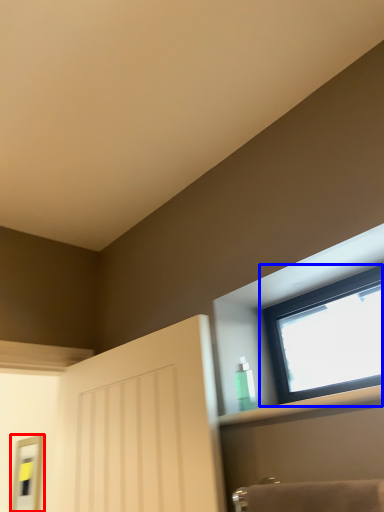
Question: Which object appears farthest to the camera in this image, mirror (highlighted by a red box) or window (highlighted by a blue box)?

Choices:
 (A) mirror
 (B) window

Answer: (A)